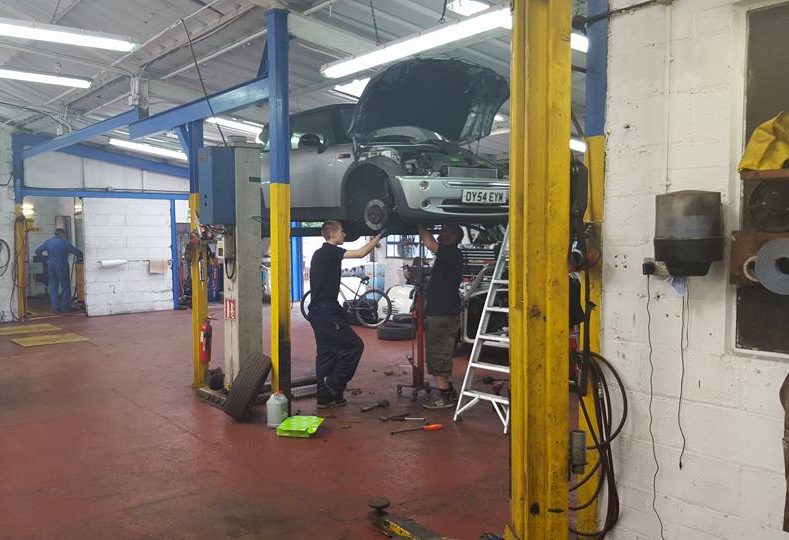
The width and height of the screenshot is (789, 540). In order to click on florescent lights in this screenshot , I will do `click(335, 69)`.